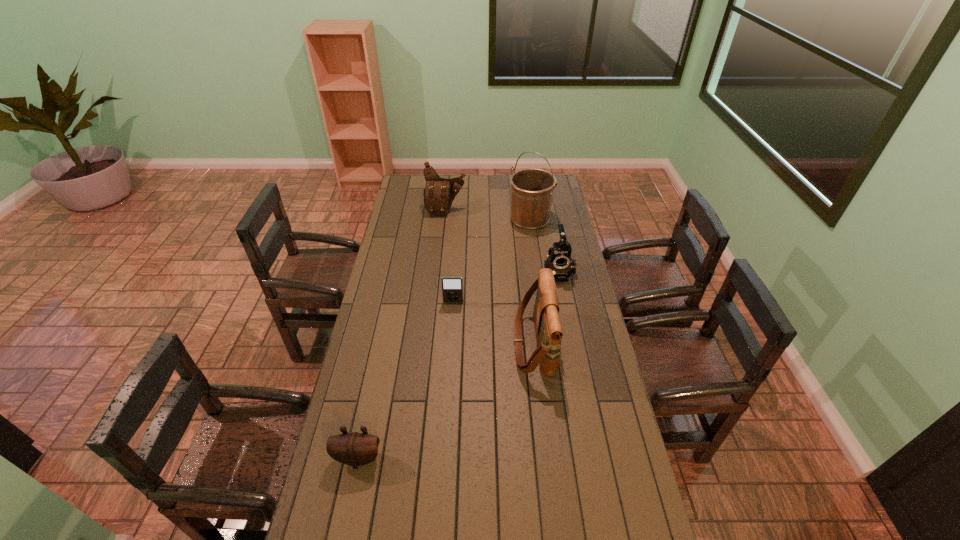
The image size is (960, 540). I want to click on free space located on the front-facing side of the farther shoulder bag, so click(441, 264).

You are a GUI agent. You are given a task and a screenshot of the screen. Output one action in this format:
    pyautogui.click(x=<x>, y=<y>)
    Task: Click on the free space located 0.220m on the front-facing side of the right shoulder bag
    
    Given the screenshot: What is the action you would take?
    pyautogui.click(x=456, y=343)

The image size is (960, 540). Find the location of `vacant point located 0.350m on the front-facing side of the right shoulder bag`. vacant point located 0.350m on the front-facing side of the right shoulder bag is located at coordinates (421, 343).

Find the location of a particular element. This screenshot has height=540, width=960. free space located 0.330m on the front-facing side of the right shoulder bag is located at coordinates (427, 343).

Locate an element on the screen. The image size is (960, 540). free spot located on the lens mount of the third shortest object is located at coordinates (564, 308).

The height and width of the screenshot is (540, 960). Find the location of `blank space located on the front-facing side of the iPod`. blank space located on the front-facing side of the iPod is located at coordinates (448, 375).

The image size is (960, 540). What are the coordinates of `blank area located with the flap open on the nearest object` in the screenshot? It's located at (349, 502).

Identify the location of shoulder bag at the left edge. (439, 193).

At what (x,y) coordinates should I click in order to perform the action: click on pouch that is at the left edge. Please return your answer as a coordinate pair (x, y). The height and width of the screenshot is (540, 960). Looking at the image, I should click on (355, 449).

Where is `bucket located in the right edge section of the desktop`? The image size is (960, 540). bucket located in the right edge section of the desktop is located at coordinates (532, 189).